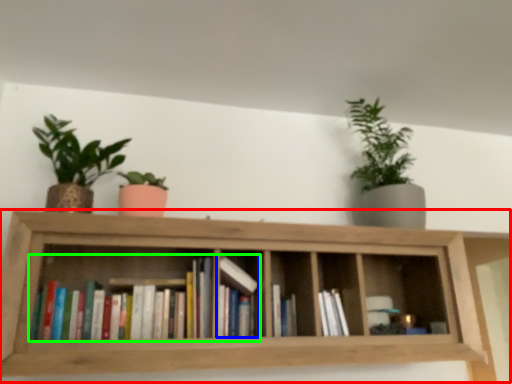
Question: Which is nearer to the shelf (highlighted by a red box)? book (highlighted by a blue box) or book (highlighted by a green box).

Choices:
 (A) book
 (B) book

Answer: (B)